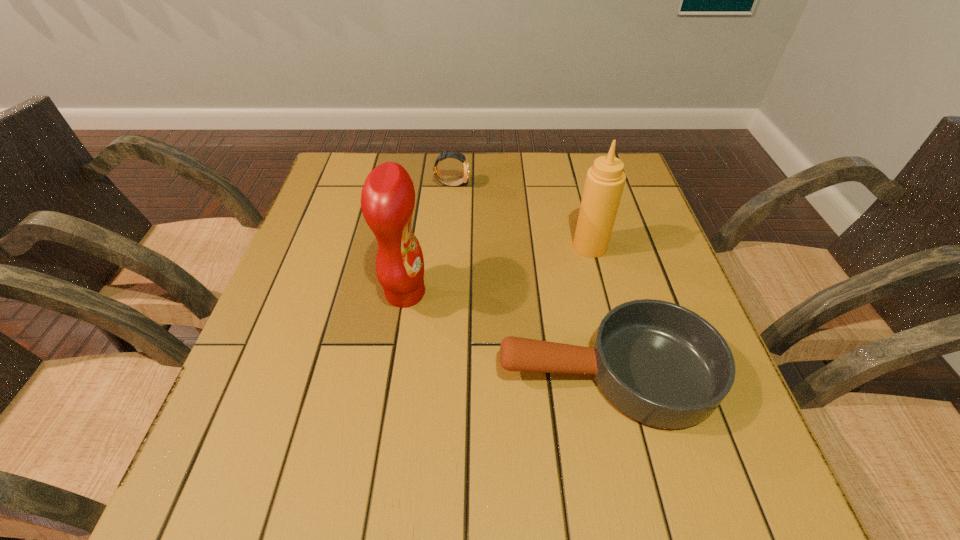
The image size is (960, 540). What are the coordinates of `unoccupied area between the nearer condiment and the shortest object` in the screenshot? It's located at (506, 333).

Find the location of `empty location between the left condiment and the right condiment`. empty location between the left condiment and the right condiment is located at coordinates (497, 270).

Locate an element on the screen. The height and width of the screenshot is (540, 960). the closest object to the right condiment is located at coordinates (661, 364).

I want to click on object that stands as the closest to the farthest object, so click(x=388, y=197).

Find the location of a particular element. The width and height of the screenshot is (960, 540). vacant area that satisfies the following two spatial constraints: 1. on the face of the farthest object; 2. on the left side of the farther condiment is located at coordinates (447, 246).

Where is `vacant position in the image that satisfies the following two spatial constraints: 1. on the face of the farthest object; 2. on the back side of the third nearest object`? The width and height of the screenshot is (960, 540). vacant position in the image that satisfies the following two spatial constraints: 1. on the face of the farthest object; 2. on the back side of the third nearest object is located at coordinates (447, 246).

Locate an element on the screen. free point that satisfies the following two spatial constraints: 1. on the front side of the right condiment; 2. on the handle side of the pan is located at coordinates (622, 373).